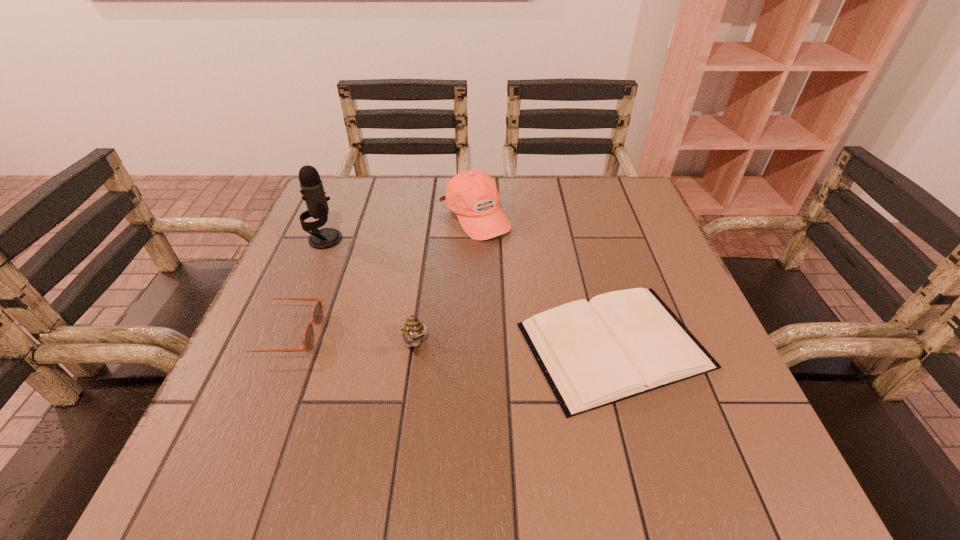
I want to click on object present at the far edge, so (x=472, y=195).

You are a GUI agent. You are given a task and a screenshot of the screen. Output one action in this format:
    pyautogui.click(x=<x>, y=<y>)
    Task: Click on the microphone that is at the left edge
    Image resolution: width=960 pixels, height=540 pixels.
    Given the screenshot: What is the action you would take?
    pyautogui.click(x=313, y=193)

At what (x,y) coordinates should I click in order to perform the action: click on sunglasses positioned at the left edge. Please return your answer as a coordinate pair (x, y). Image resolution: width=960 pixels, height=540 pixels. Looking at the image, I should click on (308, 337).

Identify the location of object at the right edge. (620, 344).

This screenshot has width=960, height=540. I want to click on blank space at the far edge, so click(432, 200).

Image resolution: width=960 pixels, height=540 pixels. In the image, there is a desktop. What are the coordinates of `vacant region at the near edge` in the screenshot? It's located at (369, 463).

Locate an element on the screen. free space at the left edge of the desktop is located at coordinates (310, 303).

This screenshot has width=960, height=540. I want to click on vacant point at the right edge, so click(628, 251).

Locate an element on the screen. The width and height of the screenshot is (960, 540). vacant space at the far left corner of the desktop is located at coordinates (349, 187).

At what (x,y) coordinates should I click in order to perform the action: click on free space at the near right corner of the desktop. Please return your answer as a coordinate pair (x, y). This screenshot has width=960, height=540. Looking at the image, I should click on (781, 477).